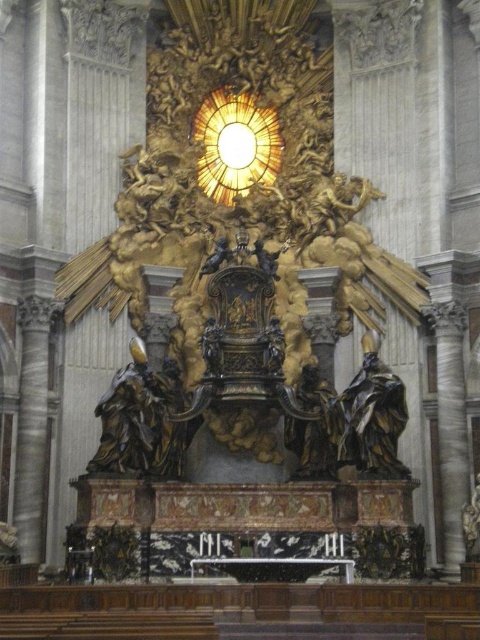
Question: Is the position of golden textured clock at upper center more distant than that of bronze statue at right?

Choices:
 (A) yes
 (B) no

Answer: (A)

Question: Where is golden textured clock at upper center located in relation to bronze statue at right in the image?

Choices:
 (A) right
 (B) left

Answer: (B)

Question: Which object appears closest to the camera in this image?

Choices:
 (A) golden textured clock at upper center
 (B) bronze statue at right

Answer: (B)

Question: Can you confirm if golden textured clock at upper center is thinner than bronze statue at right?

Choices:
 (A) yes
 (B) no

Answer: (B)